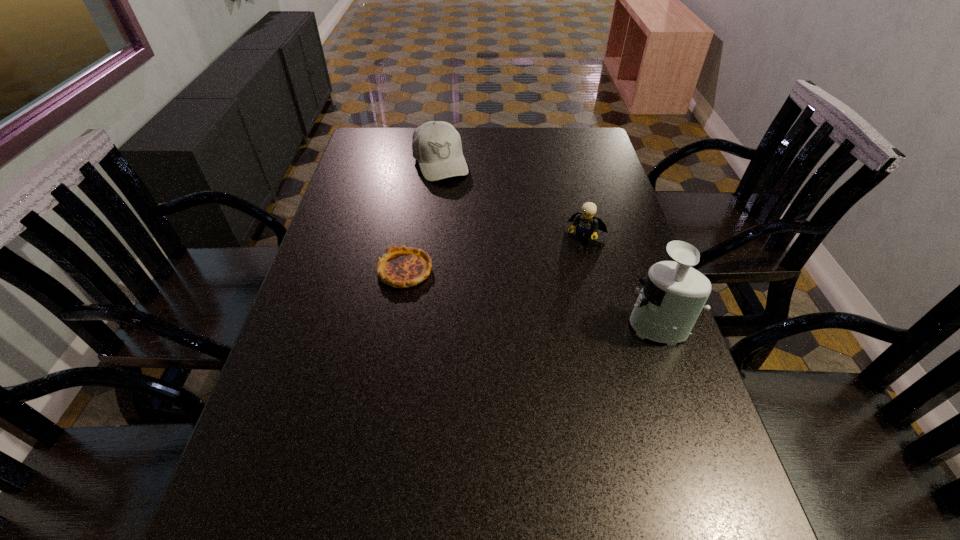
Locate an element on the screen. vacant region at the right edge of the desktop is located at coordinates (618, 394).

Locate an element on the screen. Image resolution: width=960 pixels, height=540 pixels. free space at the far right corner of the desktop is located at coordinates (564, 132).

Find the location of `vacant space at the near right corner of the desktop`. vacant space at the near right corner of the desktop is located at coordinates (682, 455).

Find the location of a particular element. The width and height of the screenshot is (960, 540). vacant area between the shortest object and the farthest object is located at coordinates (422, 216).

Find the location of a particular element. The image size is (960, 540). free space that is in between the juicer and the second farthest object is located at coordinates (620, 280).

You are a GUI agent. You are given a task and a screenshot of the screen. Output one action in this format:
    pyautogui.click(x=<x>, y=<y>)
    Task: Click on the vacant space that's between the nearest object and the third farthest object
    The image size is (960, 540).
    Given the screenshot: What is the action you would take?
    point(530,298)

Locate an element on the screen. vacant area that lies between the juicer and the Lego is located at coordinates (620, 280).

At what (x,y) coordinates should I click in order to perform the action: click on empty space between the Lego and the second nearest object. Please return your answer as a coordinate pair (x, y). The height and width of the screenshot is (540, 960). Looking at the image, I should click on (495, 253).

The image size is (960, 540). I want to click on free space that is in between the nearest object and the third farthest object, so click(x=530, y=298).

Where is `vacant space that is in between the tallest object and the baseball cap`? vacant space that is in between the tallest object and the baseball cap is located at coordinates (547, 244).